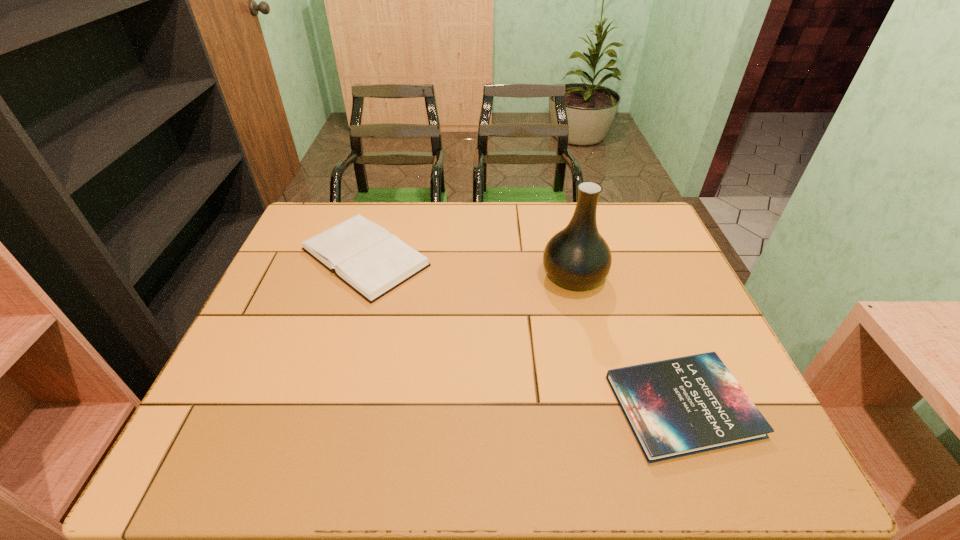
This screenshot has height=540, width=960. I want to click on object that is at the left edge, so click(364, 255).

Find the location of `object at the right edge`. object at the right edge is located at coordinates (682, 406).

Locate an element on the screen. Image resolution: width=960 pixels, height=540 pixels. object that is at the far left corner is located at coordinates (364, 255).

Find the location of a particular element. object that is at the near right corner is located at coordinates (682, 406).

In the image, there is a desktop. In order to click on vacant region at the far edge in this screenshot , I will do `click(437, 224)`.

At what (x,y) coordinates should I click in order to perform the action: click on vacant space at the near edge of the desktop. Please return your answer as a coordinate pair (x, y). Looking at the image, I should click on (391, 444).

In the image, there is a desktop. Where is `blank space at the left edge`? This screenshot has height=540, width=960. blank space at the left edge is located at coordinates (282, 303).

This screenshot has width=960, height=540. Identify the location of vacant region at the right edge of the desktop. click(x=676, y=322).

Identify the location of vacant space at the far left corner. (325, 226).

The width and height of the screenshot is (960, 540). What are the coordinates of `free space at the near left corner of the desktop` in the screenshot? It's located at (243, 434).